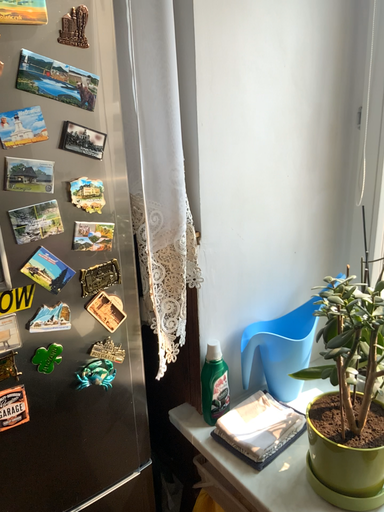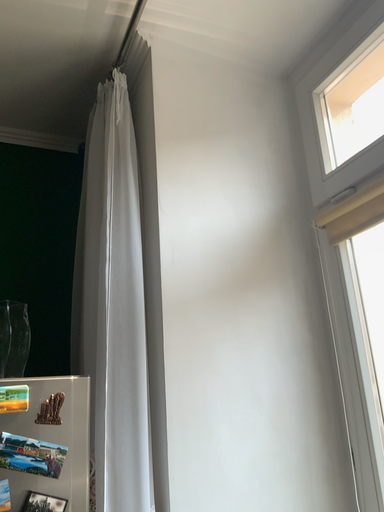
Question: Which way did the camera rotate in the video?

Choices:
 (A) rotated downward
 (B) rotated upward

Answer: (B)